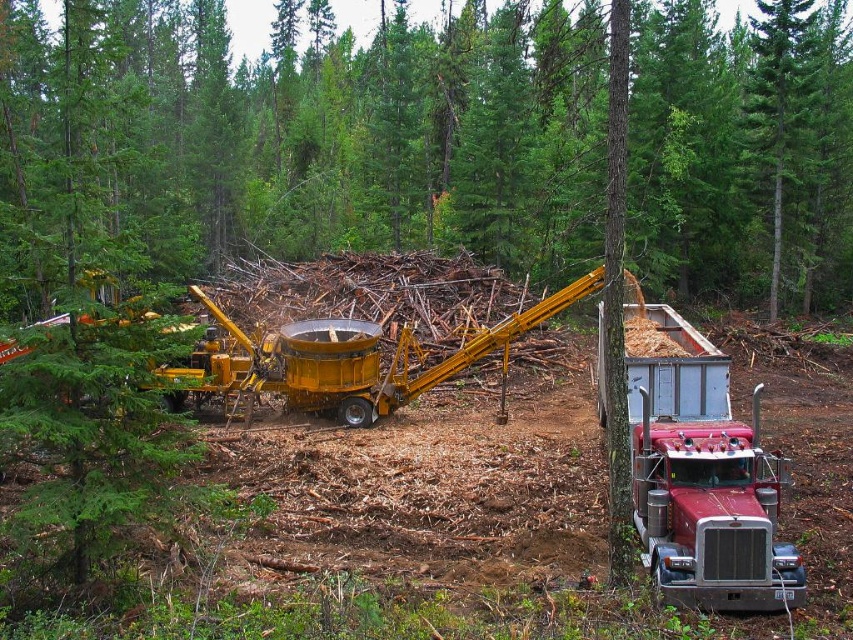
Does green textured pine forest at center appear under shiny red semi-truck at lower right?

Incorrect, green textured pine forest at center is not positioned below shiny red semi-truck at lower right.

Who is taller, green textured pine forest at center or shiny red semi-truck at lower right?

Standing taller between the two is green textured pine forest at center.

Between point (494, 112) and point (705, 509), which one is positioned behind?

Positioned behind is point (494, 112).

Where is `green textured pine forest at center`? green textured pine forest at center is located at coordinates (296, 138).

This screenshot has width=853, height=640. Describe the element at coordinates (341, 358) in the screenshot. I see `yellow metallic excavator at center` at that location.

Is the position of yellow metallic excavator at center less distant than that of metallic silver trailer truck at right?

That is True.

Between point (318, 369) and point (657, 323), which one is positioned in front?

Positioned in front is point (657, 323).

This screenshot has height=640, width=853. Find the location of `yellow metallic excavator at center`. yellow metallic excavator at center is located at coordinates (341, 358).

Who is taller, green textured pine forest at center or yellow metallic excavator at center?

green textured pine forest at center

Is green textured pine forest at center taller than yellow metallic excavator at center?

Yes, green textured pine forest at center is taller than yellow metallic excavator at center.

Between point (42, 221) and point (569, 291), which one is positioned in front?

Positioned in front is point (42, 221).

I want to click on green textured pine forest at center, so click(x=296, y=138).